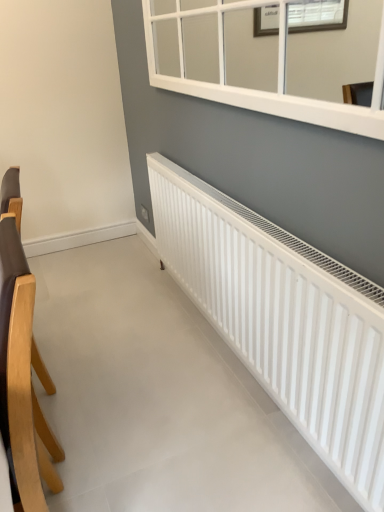
Question: From the image's perspective, relative to brown leather chair at left, is white matte radiator at lower right above or below?

Choices:
 (A) above
 (B) below

Answer: (A)

Question: Based on their sizes in the image, would you say white matte radiator at lower right is bigger or smaller than brown leather chair at left?

Choices:
 (A) big
 (B) small

Answer: (A)

Question: From a real-world perspective, is white matte radiator at lower right above or below brown leather chair at left?

Choices:
 (A) below
 (B) above

Answer: (A)

Question: In the image, is brown leather chair at left positioned in front of or behind white matte radiator at lower right?

Choices:
 (A) front
 (B) behind

Answer: (A)

Question: In terms of width, does brown leather chair at left look wider or thinner when compared to white matte radiator at lower right?

Choices:
 (A) wide
 (B) thin

Answer: (B)

Question: Is brown leather chair at left to the left or to the right of white matte radiator at lower right in the image?

Choices:
 (A) right
 (B) left

Answer: (B)

Question: In terms of height, does brown leather chair at left look taller or shorter compared to white matte radiator at lower right?

Choices:
 (A) tall
 (B) short

Answer: (A)